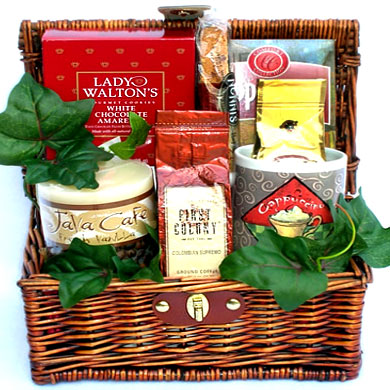
Locate an element on the screen. bottom of basket is located at coordinates 100,319.